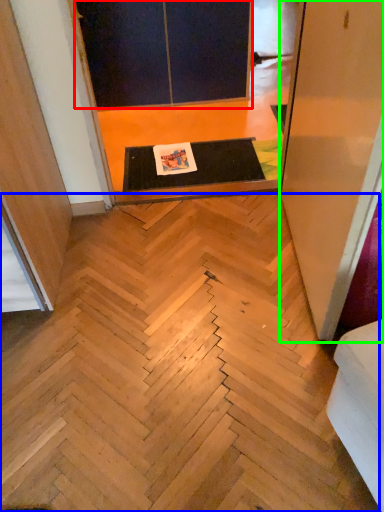
Question: Based on their relative distances, which object is nearer to screen door (highlighted by a red box)? Choose from stairwell (highlighted by a blue box) and screen door (highlighted by a green box).

Choices:
 (A) stairwell
 (B) screen door

Answer: (B)